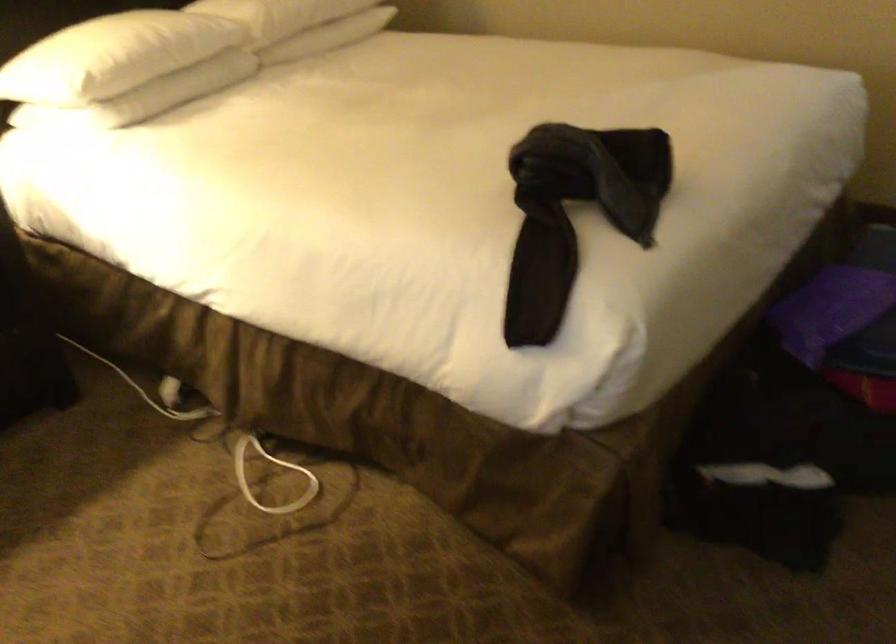
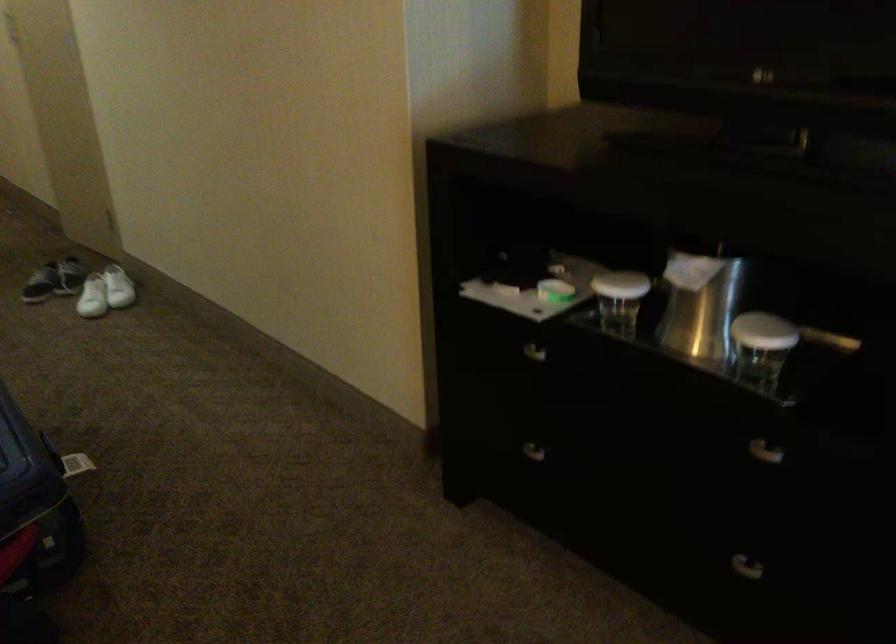
Question: The images are taken continuously from a first-person perspective. In which direction is your viewpoint rotating?

Choices:
 (A) Left
 (B) Right
 (C) Up
 (D) Down

Answer: (B)